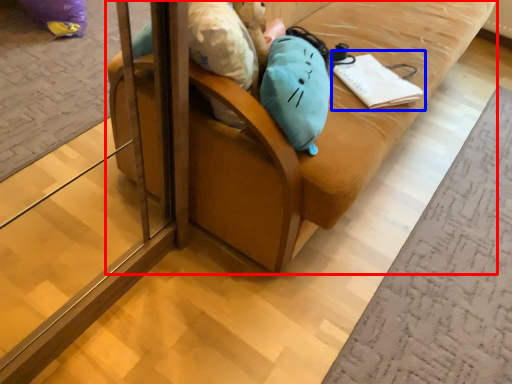
Question: Which point is further to the camera, furniture (highlighted by a red box) or notebook (highlighted by a blue box)?

Choices:
 (A) furniture
 (B) notebook

Answer: (B)